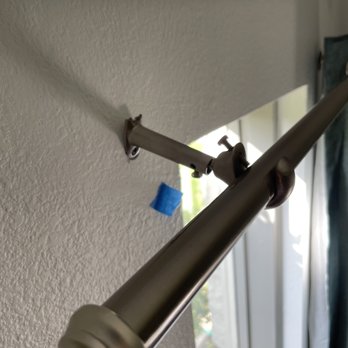
The width and height of the screenshot is (348, 348). Identify the location of the top right corner of window. (309, 86).